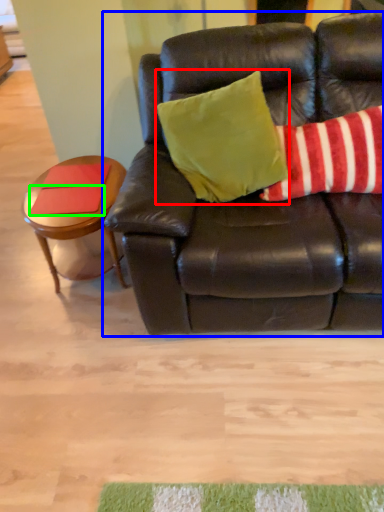
Question: Estimate the real-world distances between objects in this image. Which object is farther from pillow (highlighted by a red box), studio couch (highlighted by a blue box) or pad (highlighted by a green box)?

Choices:
 (A) studio couch
 (B) pad

Answer: (B)